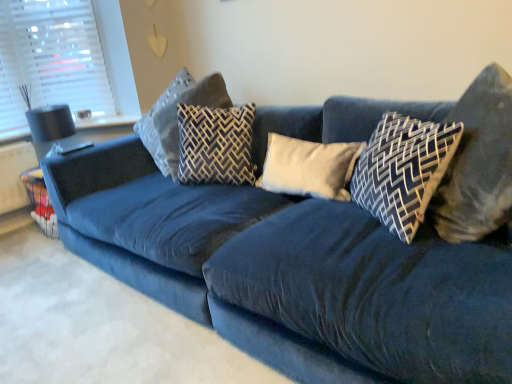
Question: Is dark blue fabric pillow at center, the 4th pillow from the left, to the right of patterned fabric pillow at center, marked as the 2th pillow in a left-to-right arrangement, from the viewer's perspective?

Choices:
 (A) yes
 (B) no

Answer: (A)

Question: From a real-world perspective, is dark blue fabric pillow at center, which ranks as the 2th pillow in right-to-left order, below patterned fabric pillow at center, the fourth pillow viewed from the right?

Choices:
 (A) no
 (B) yes

Answer: (B)

Question: Considering the relative sizes of dark blue fabric pillow at center, which ranks as the 2th pillow in right-to-left order, and patterned fabric pillow at center, marked as the 2th pillow in a left-to-right arrangement, in the image provided, is dark blue fabric pillow at center, which ranks as the 2th pillow in right-to-left order, taller than patterned fabric pillow at center, marked as the 2th pillow in a left-to-right arrangement,?

Choices:
 (A) no
 (B) yes

Answer: (A)

Question: Is the position of dark blue fabric pillow at center, the 4th pillow from the left, less distant than that of patterned fabric pillow at center, the fourth pillow viewed from the right?

Choices:
 (A) no
 (B) yes

Answer: (B)

Question: Does dark blue fabric pillow at center, which ranks as the 2th pillow in right-to-left order, have a smaller size compared to patterned fabric pillow at center, marked as the 2th pillow in a left-to-right arrangement?

Choices:
 (A) yes
 (B) no

Answer: (A)

Question: Is dark blue fabric pillow at center, which ranks as the 2th pillow in right-to-left order, wider than patterned fabric pillow at center, the fourth pillow viewed from the right?

Choices:
 (A) no
 (B) yes

Answer: (A)

Question: From a real-world perspective, is patterned fabric pillow at center, marked as the 2th pillow in a left-to-right arrangement, over dark gray fabric pillow at center, acting as the 5th pillow starting from the right?

Choices:
 (A) yes
 (B) no

Answer: (B)

Question: Is patterned fabric pillow at center, marked as the 2th pillow in a left-to-right arrangement, outside of dark gray fabric pillow at center, which is the first pillow from left to right?

Choices:
 (A) no
 (B) yes

Answer: (B)

Question: Are patterned fabric pillow at center, marked as the 2th pillow in a left-to-right arrangement, and dark gray fabric pillow at center, acting as the 5th pillow starting from the right, making contact?

Choices:
 (A) yes
 (B) no

Answer: (B)

Question: Is patterned fabric pillow at center, the fourth pillow viewed from the right, thinner than dark gray fabric pillow at center, which is the first pillow from left to right?

Choices:
 (A) no
 (B) yes

Answer: (B)

Question: Considering the relative sizes of patterned fabric pillow at center, the fourth pillow viewed from the right, and dark gray fabric pillow at center, which is the first pillow from left to right, in the image provided, is patterned fabric pillow at center, the fourth pillow viewed from the right, taller than dark gray fabric pillow at center, which is the first pillow from left to right,?

Choices:
 (A) yes
 (B) no

Answer: (B)

Question: Is patterned fabric pillow at center, marked as the 2th pillow in a left-to-right arrangement, to the right of dark gray fabric pillow at center, which is the first pillow from left to right, from the viewer's perspective?

Choices:
 (A) yes
 (B) no

Answer: (A)

Question: From the image's perspective, is dark blue fabric pillow at upper right, positioned as the fifth pillow in left-to-right order, above dark gray fabric pillow at center, acting as the 5th pillow starting from the right?

Choices:
 (A) yes
 (B) no

Answer: (B)